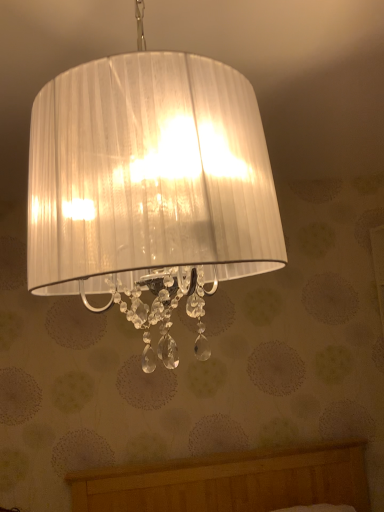
Question: Should I look upward or downward to see white pleated fabric lampshade at upper center?

Choices:
 (A) up
 (B) down

Answer: (A)